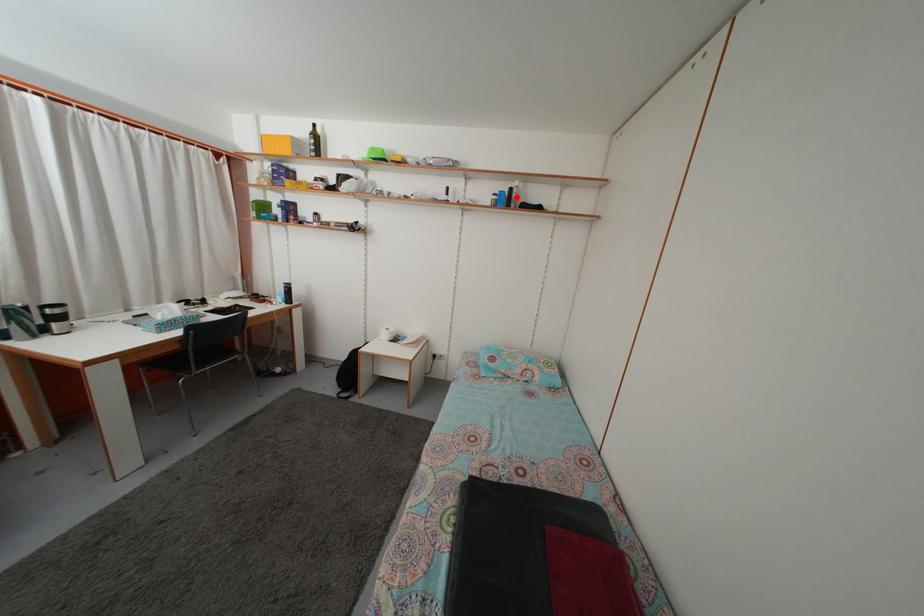
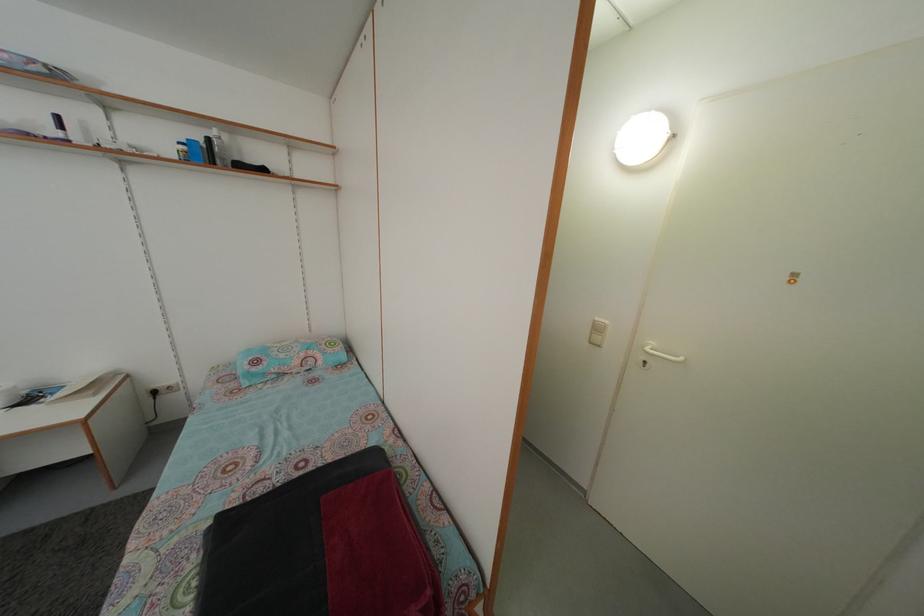
Find the pixel in the second image that matches the highlighted location in the first image.

(214, 148)